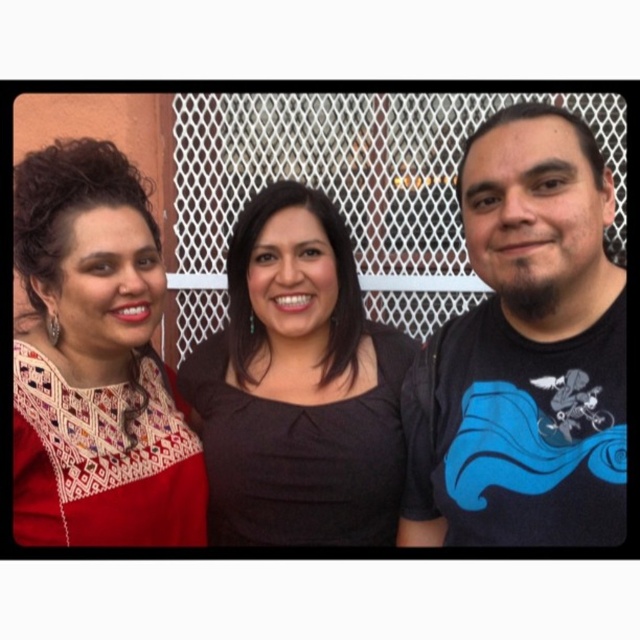
Question: Is black cotton t-shirt at right in front of black matte dress at center?

Choices:
 (A) no
 (B) yes

Answer: (B)

Question: Does embroidered fabric dress at left have a larger size compared to black matte dress at center?

Choices:
 (A) no
 (B) yes

Answer: (B)

Question: Can you confirm if matte black dress at center is smaller than black matte dress at center?

Choices:
 (A) no
 (B) yes

Answer: (A)

Question: Which object is closer to the camera taking this photo?

Choices:
 (A) embroidered fabric dress at left
 (B) black matte dress at center

Answer: (A)

Question: Which point is closer to the camera?

Choices:
 (A) (529, 243)
 (B) (170, 499)
 (C) (211, 234)
 (D) (388, 417)

Answer: (A)

Question: Which of these objects is positioned farthest from the embroidered fabric dress at left?

Choices:
 (A) matte black dress at center
 (B) black cotton t-shirt at right

Answer: (A)